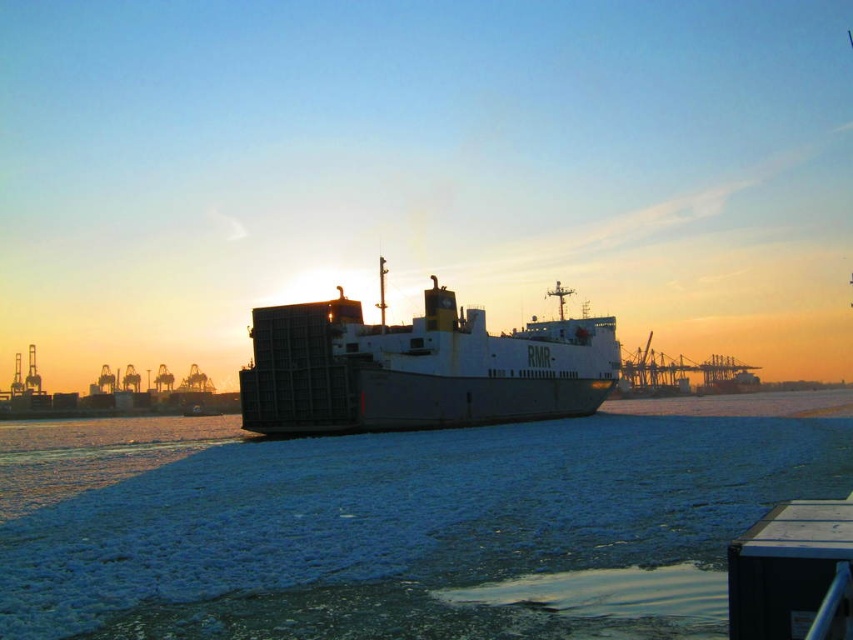
You are navigating a small boat and need to avoid the blue frosted water at center. Based on the coordinates provided, where should you steer your boat to stay clear of the frosted area?

The blue frosted water at center is located at coordinates point (402, 524). To avoid it, steer your boat away from that point, preferably towards areas with lower coordinate values or higher coordinate values depending on your current position.